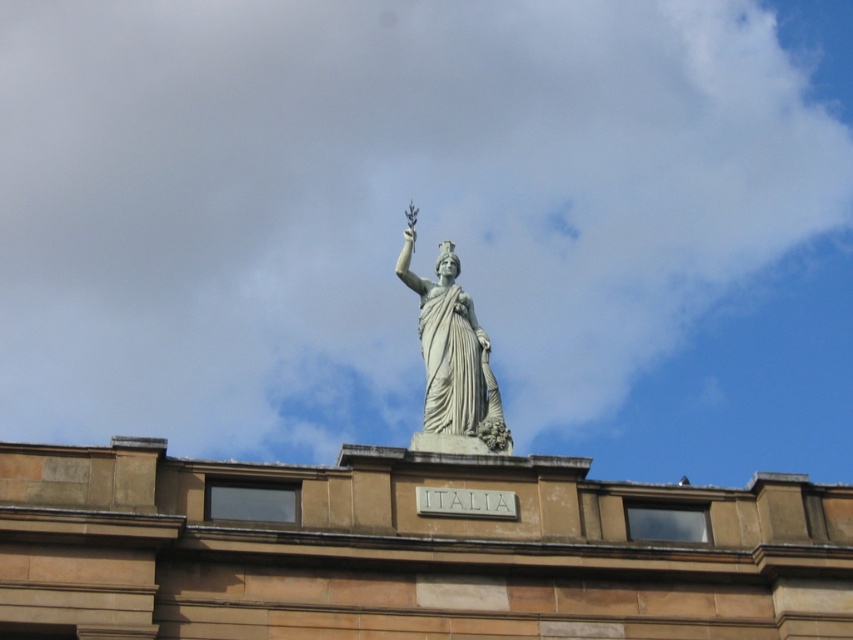
You are a drone operator trying to capture a photo of the statue atop the building. You need to ensure that the white fluffy cloud at upper center doesn not block the statue in your shot. Given that your drone can fly up to 500 feet, will you be able to position it close enough to avoid the cloud?

The white fluffy cloud at upper center is 506.70 feet from the camera. Since your drone can only fly up to 500 feet, you won not be able to position it close enough to avoid the cloud blocking the statue.

You are an architect designing a new building and want to ensure that the white marble statue at center is visible from a distance. Considering the presence of the white fluffy cloud at upper center, which object might obstruct the view of the statue and why?

The white fluffy cloud at upper center could obstruct the view of the white marble statue at center because it is larger in size than the statue, potentially blocking it from sight depending on their relative positions.

You are an architect designing a new building and want to place a statue similar to the one in the image. If you want to ensure that the statue is positioned so that it aligns with the center of the white fluffy cloud at upper center, where should you place the statue on your blueprint? Provide the coordinates from the Objects Description.

The white fluffy cloud at upper center is located at coordinates point (430,225). Therefore, to align the statue with the center of the white fluffy cloud at upper center, you should place the statue at those coordinates on your blueprint.